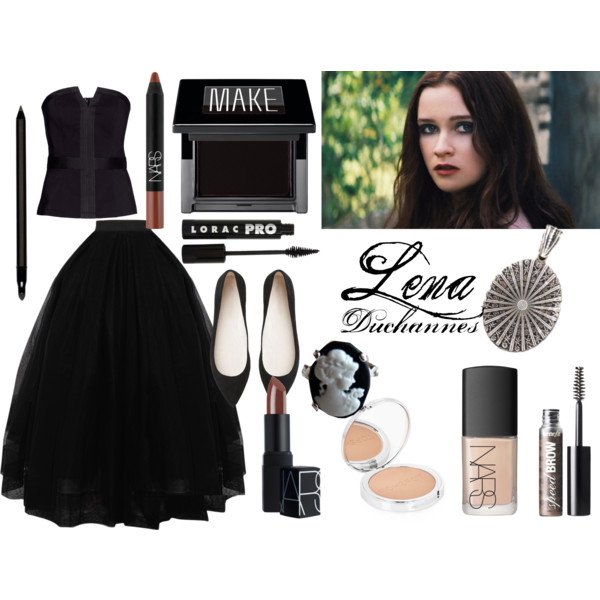
Image resolution: width=600 pixels, height=600 pixels. What are the coordinates of `mirror` in the screenshot? It's located at (399, 431).